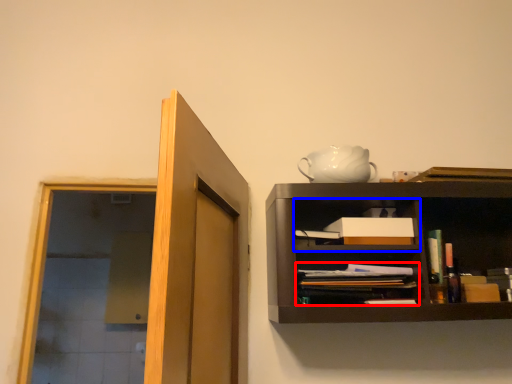
Question: Which of the following is the farthest to the observer, book (highlighted by a red box) or cabinet (highlighted by a blue box)?

Choices:
 (A) book
 (B) cabinet

Answer: (B)